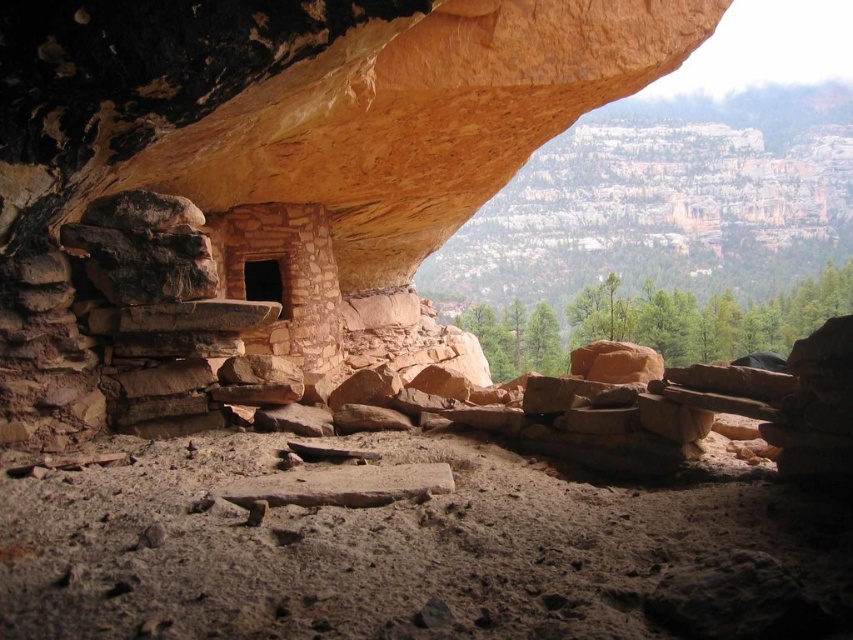
Which is more to the left, rustic stone shelter at center or brown stone cave at center?

From the viewer's perspective, brown stone cave at center appears more on the left side.

Who is more distant from viewer, (x=67, y=106) or (x=247, y=276)?

Point (x=247, y=276)

The height and width of the screenshot is (640, 853). In order to click on rustic stone shelter at center in this screenshot , I will do `click(262, 173)`.